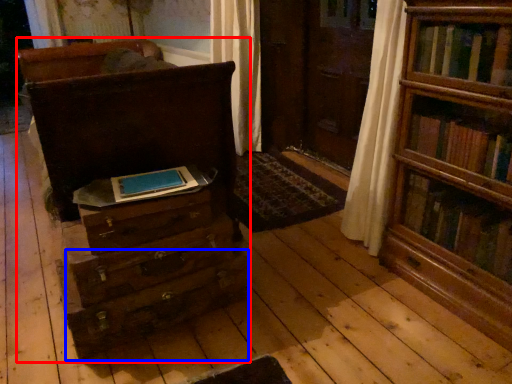
Question: Which object appears closest to the camera in this image, chest of drawers (highlighted by a red box) or drawer (highlighted by a blue box)?

Choices:
 (A) chest of drawers
 (B) drawer

Answer: (A)